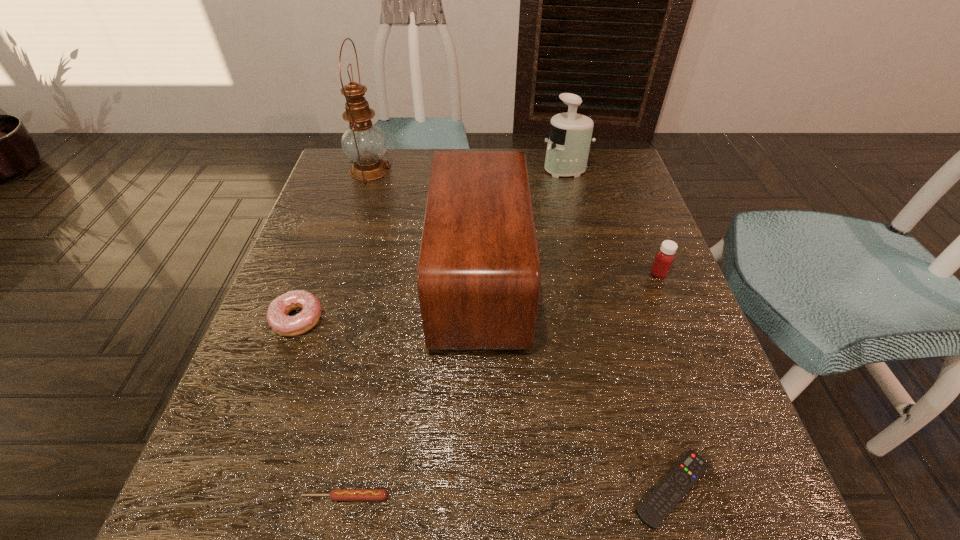
This screenshot has height=540, width=960. I want to click on object that is the third closest to the sixth tallest object, so click(666, 495).

You are a GUI agent. You are given a task and a screenshot of the screen. Output one action in this format:
    pyautogui.click(x=<x>, y=<y>)
    Task: Click on the vacant area in the image that satisfies the following two spatial constraints: 1. on the front side of the juicer; 2. on the left side of the rightmost object
    
    Given the screenshot: What is the action you would take?
    pyautogui.click(x=590, y=273)